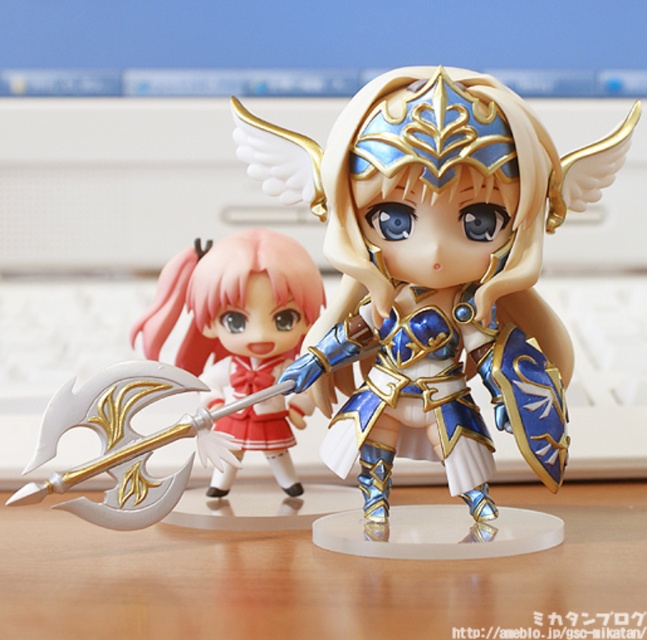
In the scene shown: You are organizing a display for these two items, the blue metallic armor at center and the matte gold axe at center. If you want to place them side by side on a shelf, which item should be placed first to ensure they fit properly?

The blue metallic armor at center is larger in size than the matte gold axe at center, so you should place the blue metallic armor at center first to accommodate its larger size before positioning the matte gold axe at center.

You are placing a new figurine on the wooden table at center. If the table is represented by coordinates where the bottom left corner is 0,0 and the top right corner is 1,1, and the table is at position 0.905, 0.499, where exactly would you place the new figurine to ensure it is centered on the table?

The wooden table at center is located at coordinates (322, 579), so placing the new figurine at those coordinates would center it on the table.

You are standing in front of the wooden surface with the two figurines. There are two points marked on the surface. Which point is closer to you, point (x=300, y=164) or point (x=36, y=525)?

Point (x=300, y=164) is closer to the viewer than point (x=36, y=525).